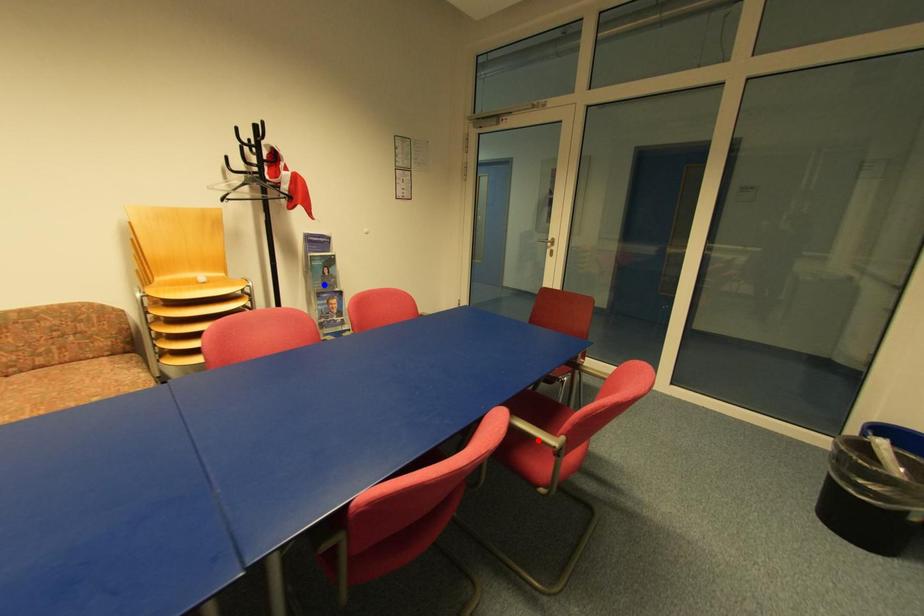
Question: Two points are marked on the image. Which point is closer to the camera?

Choices:
 (A) Blue point is closer.
 (B) Red point is closer.

Answer: (B)